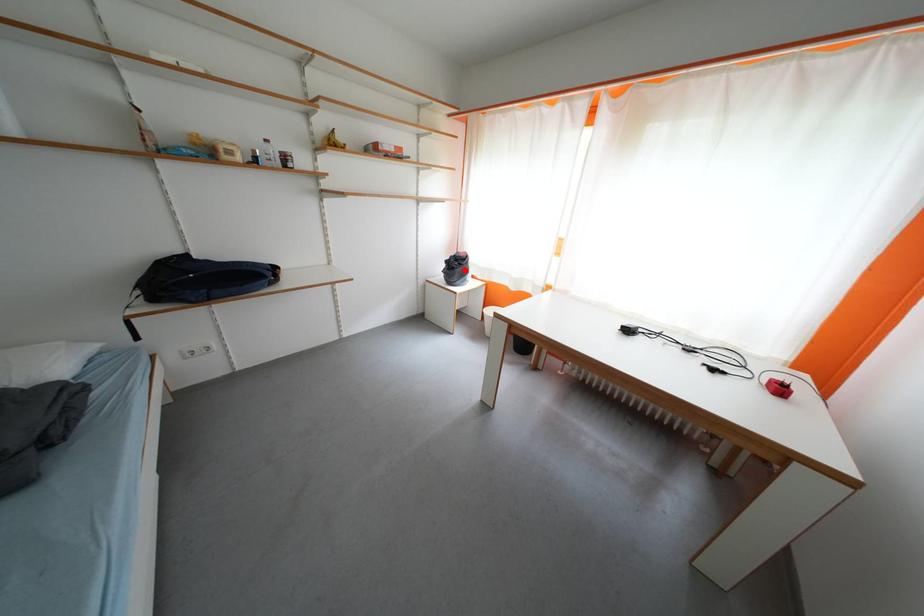
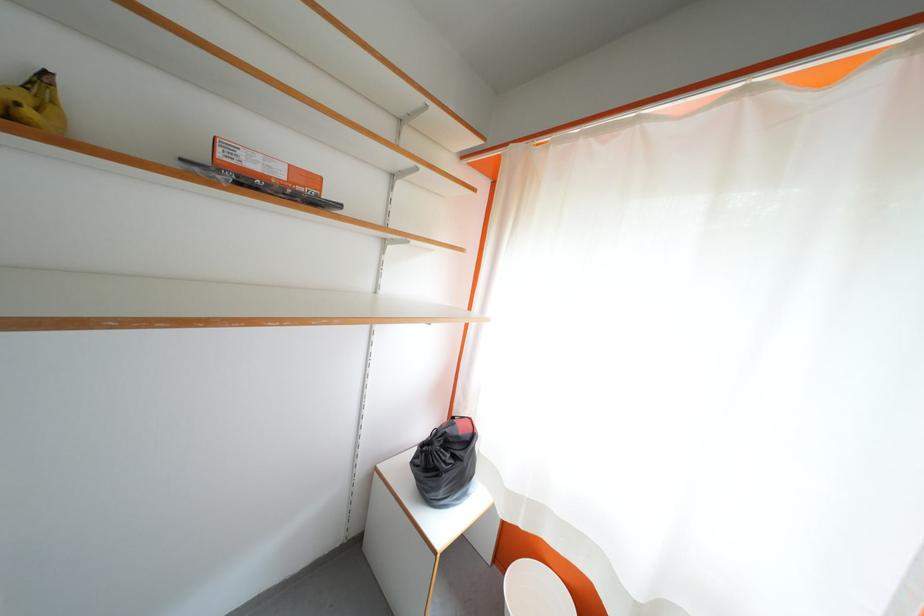
Question: I am providing you with two images of the same scene from different viewpoints. Given a red point in image1, look at the same physical point in image2. Is it:

Choices:
 (A) Closer to the viewpoint
 (B) Farther from the viewpoint

Answer: (B)